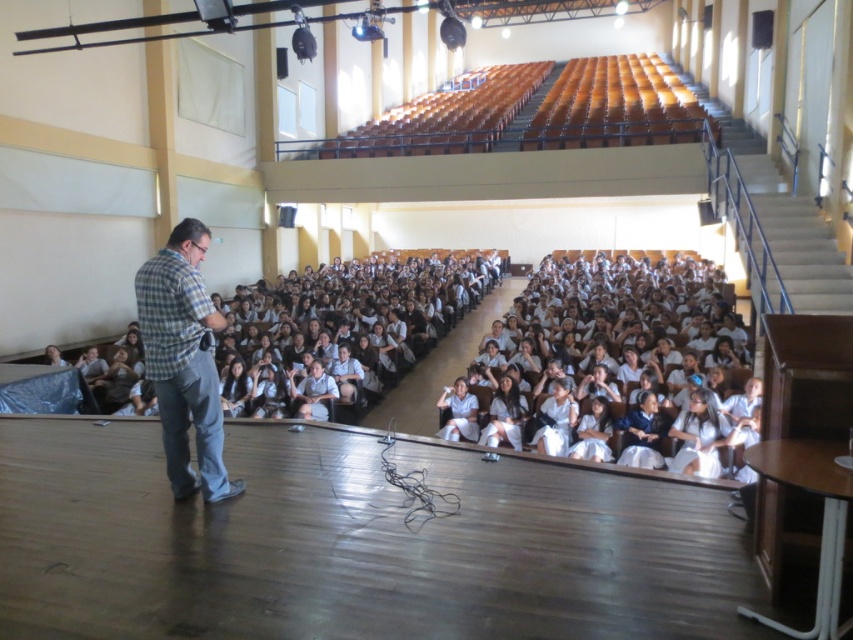
Question: Is white uniformed students at center to the right of plaid shirt at left from the viewer's perspective?

Choices:
 (A) yes
 (B) no

Answer: (A)

Question: Does white uniformed students at center appear on the left side of plaid shirt at left?

Choices:
 (A) yes
 (B) no

Answer: (B)

Question: Can you confirm if white uniformed students at center is positioned to the left of plaid shirt at left?

Choices:
 (A) yes
 (B) no

Answer: (B)

Question: Which object appears closest to the camera in this image?

Choices:
 (A) white uniformed students at center
 (B) plaid shirt at left

Answer: (B)